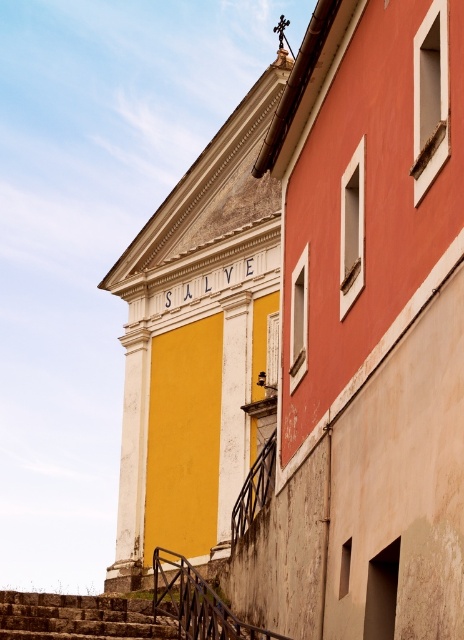
Question: Can you confirm if stone stairs at lower left is wider than black wrought iron railing at lower center?

Choices:
 (A) no
 (B) yes

Answer: (B)

Question: Which point is closer to the camera?

Choices:
 (A) (186, 612)
 (B) (260, 481)
 (C) (135, 305)
 (D) (79, 620)

Answer: (A)

Question: Considering the real-world distances, which object is closest to the black wrought iron railing at lower center?

Choices:
 (A) black metal railing at lower center
 (B) yellow matte wall at center

Answer: (A)

Question: Which point is farther to the camera?

Choices:
 (A) black wrought iron railing at lower center
 (B) stone stairs at lower left

Answer: (A)

Question: Is yellow matte wall at center behind black metal railing at lower center?

Choices:
 (A) no
 (B) yes

Answer: (B)

Question: Can you confirm if stone stairs at lower left is positioned below black wrought iron railing at lower center?

Choices:
 (A) no
 (B) yes

Answer: (B)